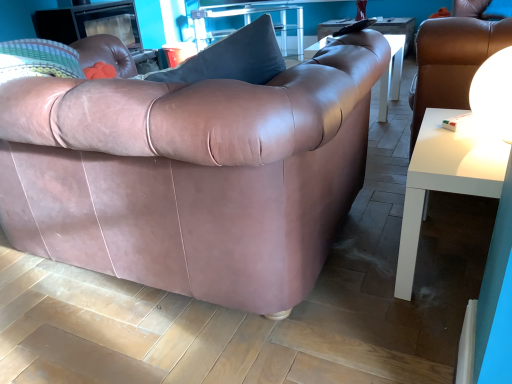
Question: Is white glossy side table at right at the right side of white glossy table at lower right, acting as the first table starting from the bottom?

Choices:
 (A) yes
 (B) no

Answer: (A)

Question: Is white glossy side table at right positioned in front of white glossy table at lower right, arranged as the second table when viewed from the top?

Choices:
 (A) no
 (B) yes

Answer: (A)

Question: Is white glossy side table at right thinner than white glossy table at lower right, which is counted as the 2th table, starting from the left?

Choices:
 (A) no
 (B) yes

Answer: (A)

Question: Is white glossy side table at right smaller than white glossy table at lower right, which is counted as the 2th table, starting from the left?

Choices:
 (A) yes
 (B) no

Answer: (B)

Question: Can white glossy table at lower right, marked as the second table in a back-to-front arrangement, be found inside white glossy side table at right?

Choices:
 (A) yes
 (B) no

Answer: (B)

Question: From a real-world perspective, does white glossy side table at right stand above white glossy table at lower right, which is counted as the 2th table, starting from the left?

Choices:
 (A) yes
 (B) no

Answer: (A)

Question: Is the depth of white glossy table at lower right, which appears as the 1th table when viewed from the front, less than that of white glossy sphere at upper right?

Choices:
 (A) no
 (B) yes

Answer: (B)

Question: Can you confirm if white glossy table at lower right, arranged as the second table when viewed from the top, is bigger than white glossy sphere at upper right?

Choices:
 (A) yes
 (B) no

Answer: (A)

Question: Is white glossy table at lower right, acting as the first table starting from the bottom, smaller than white glossy sphere at upper right?

Choices:
 (A) yes
 (B) no

Answer: (B)

Question: Does white glossy table at lower right, acting as the first table starting from the bottom, have a lesser height compared to white glossy sphere at upper right?

Choices:
 (A) no
 (B) yes

Answer: (A)

Question: From a real-world perspective, is white glossy table at lower right, marked as the second table in a back-to-front arrangement, over white glossy sphere at upper right?

Choices:
 (A) no
 (B) yes

Answer: (A)

Question: Can you confirm if white glossy table at lower right, which appears as the 1th table when viewed from the front, is positioned to the left of white glossy sphere at upper right?

Choices:
 (A) no
 (B) yes

Answer: (B)

Question: From the image's perspective, does white glossy sphere at upper right appear lower than matte leather couch at center?

Choices:
 (A) no
 (B) yes

Answer: (A)